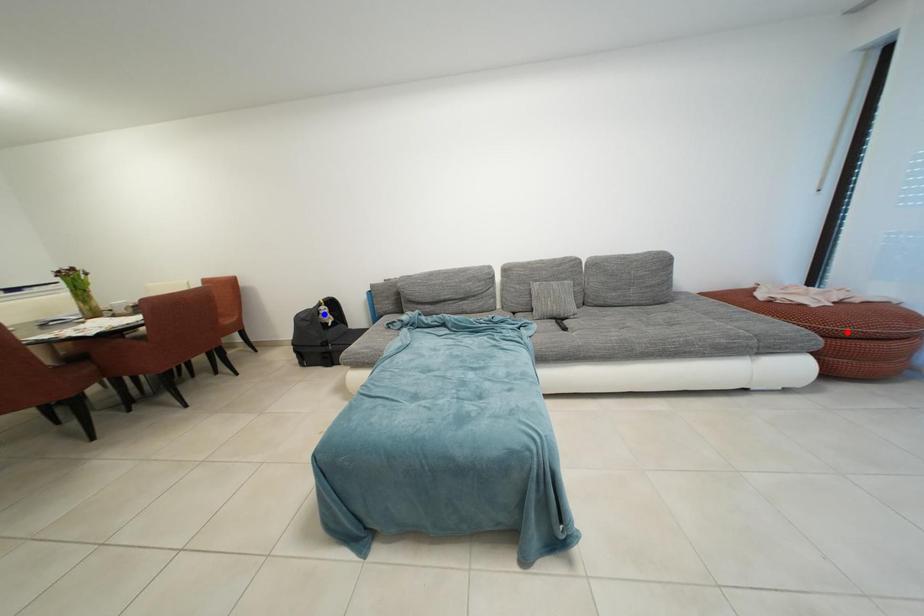
Question: Which of the two points in the image is closer to the camera?

Choices:
 (A) Blue point is closer.
 (B) Red point is closer.

Answer: (B)